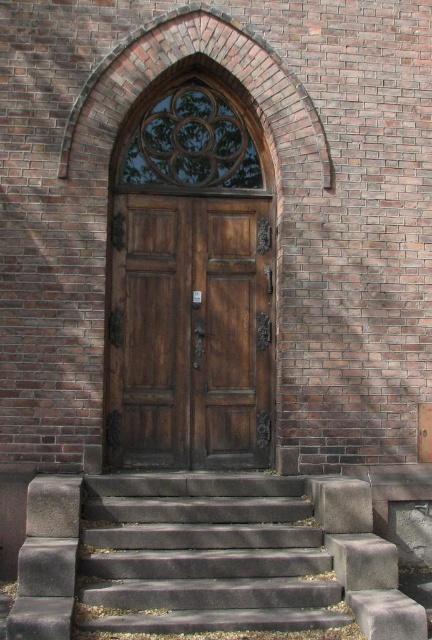
You are a painter who needs to know if you can reach the top of the polished wood door at center without standing on the gray concrete stairs at lower center. Can you do it?

The polished wood door at center is taller than the gray concrete stairs at lower center, so you can reach the top of the polished wood door at center without needing to stand on the gray concrete stairs at lower center.

You are standing at the bottom of the gray concrete stairs at lower center and want to enter through the polished wood door at center. In which direction should you move relative to the stairs?

The polished wood door at center is to the right of the gray concrete stairs at lower center, so you should move to the right relative to the stairs to reach the door.